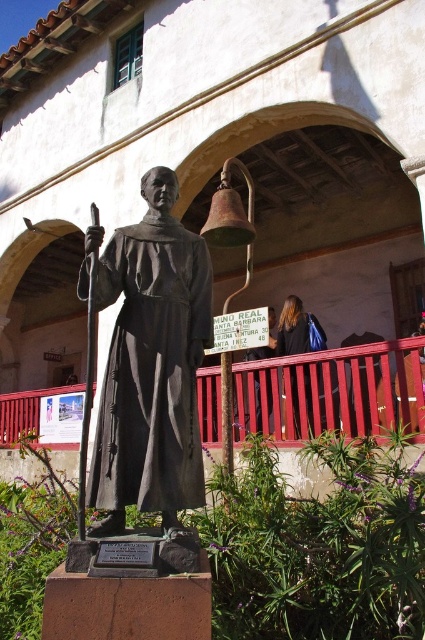
How much distance is there between matte black robe at center and dark brown hair at upper center?

matte black robe at center is 6.67 meters from dark brown hair at upper center.

Does matte black robe at center have a greater height compared to dark brown hair at upper center?

Yes.

Which is in front, point (108, 417) or point (266, 385)?

Point (108, 417)

The height and width of the screenshot is (640, 425). Find the location of `matte black robe at center`. matte black robe at center is located at coordinates (152, 369).

Who is taller, matte black robe at center or blonde hair at upper right?

With more height is matte black robe at center.

Is matte black robe at center positioned at the back of blonde hair at upper right?

No, matte black robe at center is closer to the viewer.

Is point (121, 264) positioned before point (285, 332)?

Yes, point (121, 264) is in front of point (285, 332).

Where is `matte black robe at center`? This screenshot has width=425, height=640. matte black robe at center is located at coordinates (152, 369).

In the scene shown: Measure the distance between blonde hair at upper right and camera.

blonde hair at upper right and camera are 9.32 meters apart.

Can you confirm if blonde hair at upper right is smaller than dark brown hair at upper center?

Incorrect, blonde hair at upper right is not smaller in size than dark brown hair at upper center.

Is point (283, 336) positioned in front of point (269, 394)?

No.

This screenshot has width=425, height=640. In order to click on blonde hair at upper right in this screenshot , I will do `click(297, 330)`.